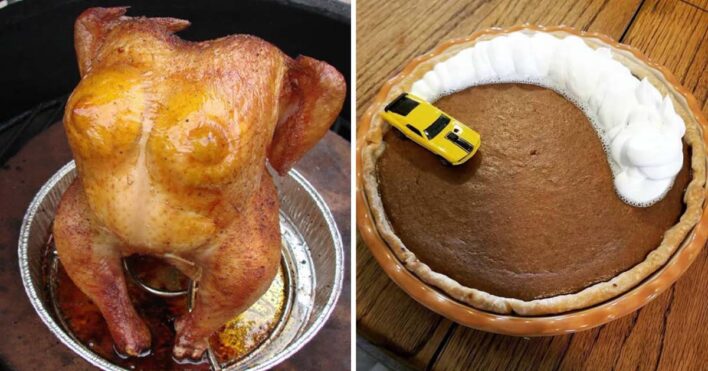
Where is `metallic turkey holder`? metallic turkey holder is located at coordinates (163, 295).